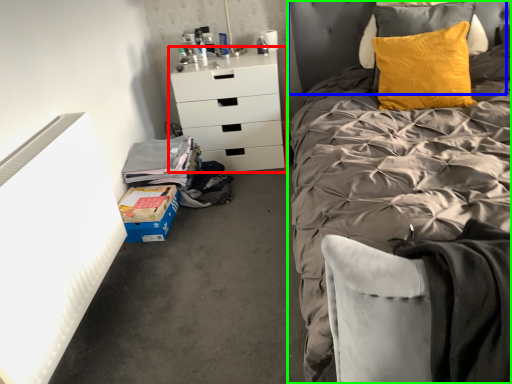
Question: Estimate the real-world distances between objects in this image. Which object is closer to chest of drawers (highlighted by a red box), headboard (highlighted by a blue box) or bed (highlighted by a green box)?

Choices:
 (A) headboard
 (B) bed

Answer: (A)